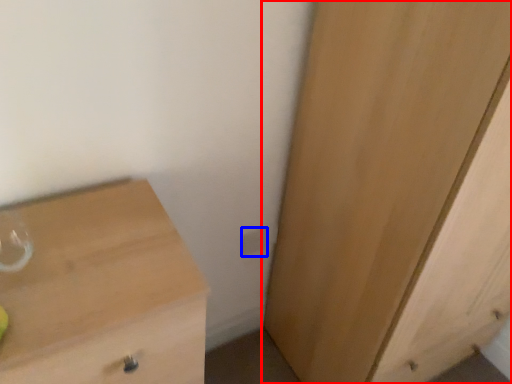
Question: Which object is closer to the camera taking this photo, cupboard (highlighted by a red box) or electric outlet (highlighted by a blue box)?

Choices:
 (A) cupboard
 (B) electric outlet

Answer: (A)